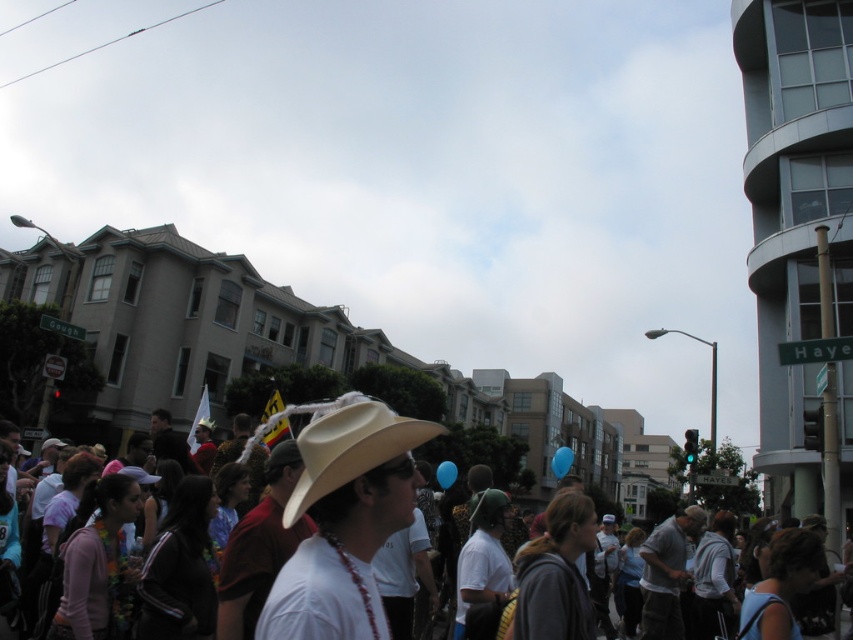
Question: Which point is farther from the camera taking this photo?

Choices:
 (A) (286, 524)
 (B) (45, 486)

Answer: (B)

Question: Considering the relative positions of white matte cowboy hat at center and beige felt cowboy hat at center in the image provided, where is white matte cowboy hat at center located with respect to beige felt cowboy hat at center?

Choices:
 (A) right
 (B) left

Answer: (A)

Question: Is white matte cowboy hat at center below beige felt cowboy hat at center?

Choices:
 (A) yes
 (B) no

Answer: (A)

Question: Is white matte cowboy hat at center smaller than beige felt cowboy hat at center?

Choices:
 (A) yes
 (B) no

Answer: (B)

Question: Which point appears farthest from the camera in this image?

Choices:
 (A) (247, 461)
 (B) (332, 467)

Answer: (A)